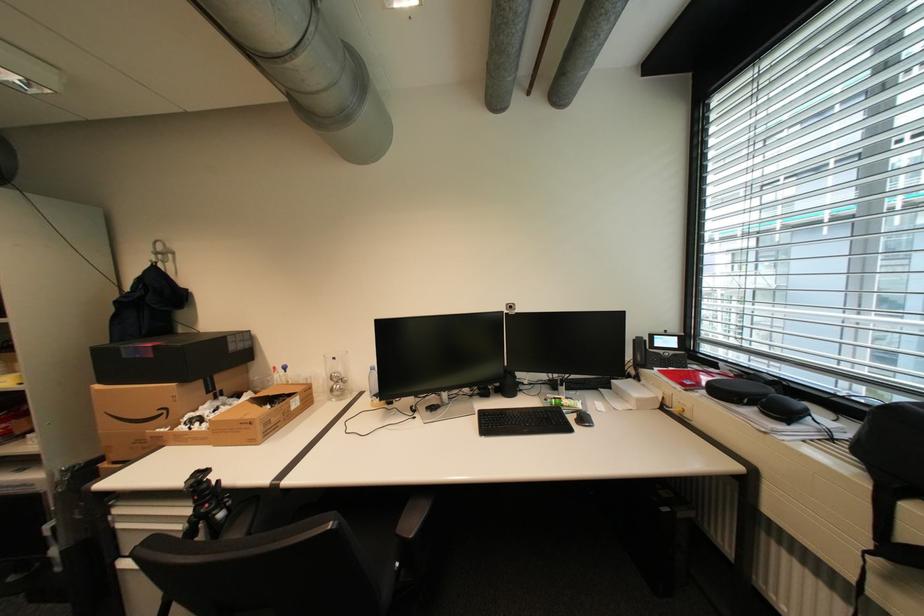
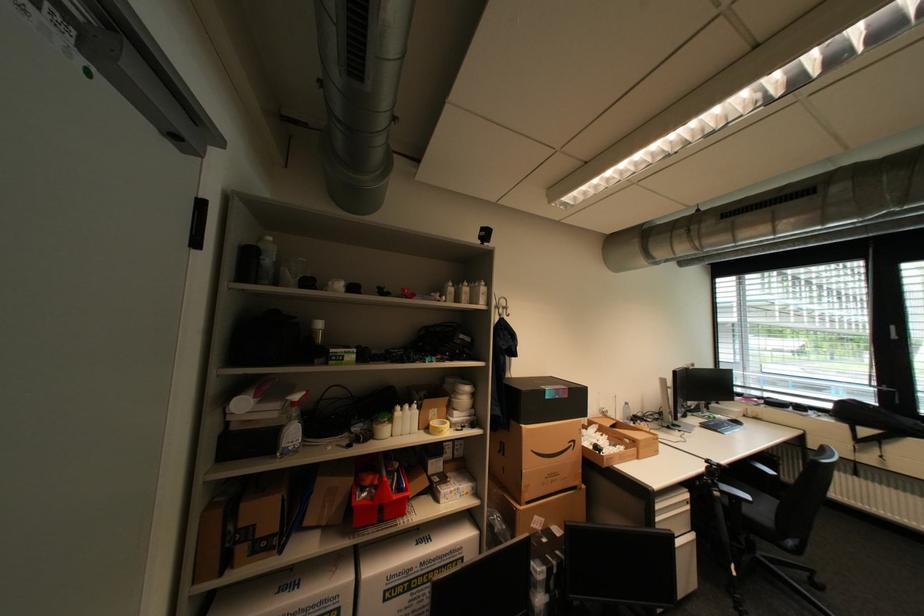
Question: What movement of the cameraman would produce the second image?

Choices:
 (A) Left
 (B) Right
 (C) Forward
 (D) Backward

Answer: (A)